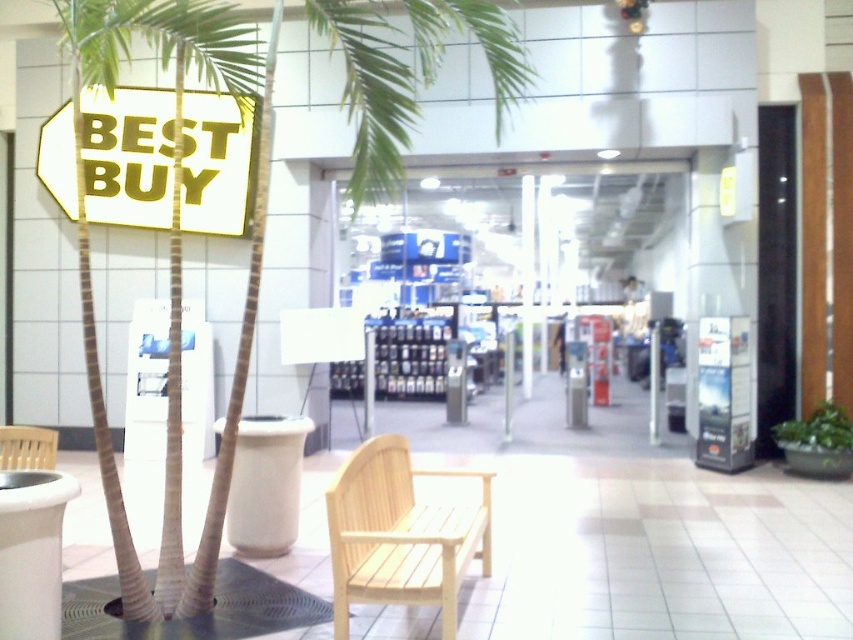
You are a customer entering the Best Buy store and want to sit down. You see the metallic pole at center and the wooden bench at lower left. Which object is closer to you so you can sit?

The wooden bench at lower left is closer to you than the metallic pole at center, so you can sit there.

You are a customer entering the Best Buy store and want to sit down. You see the light wood bench at lower center and the wooden bench at lower left. Which bench can accommodate more people?

The light wood bench at lower center is larger in size than the wooden bench at lower left, so it can accommodate more people.